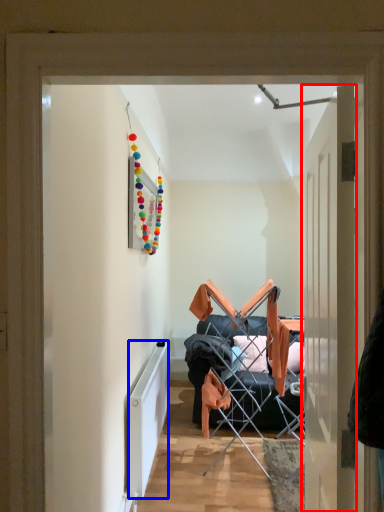
Question: Which object is further to the camera taking this photo, door (highlighted by a red box) or radiator (highlighted by a blue box)?

Choices:
 (A) door
 (B) radiator

Answer: (B)